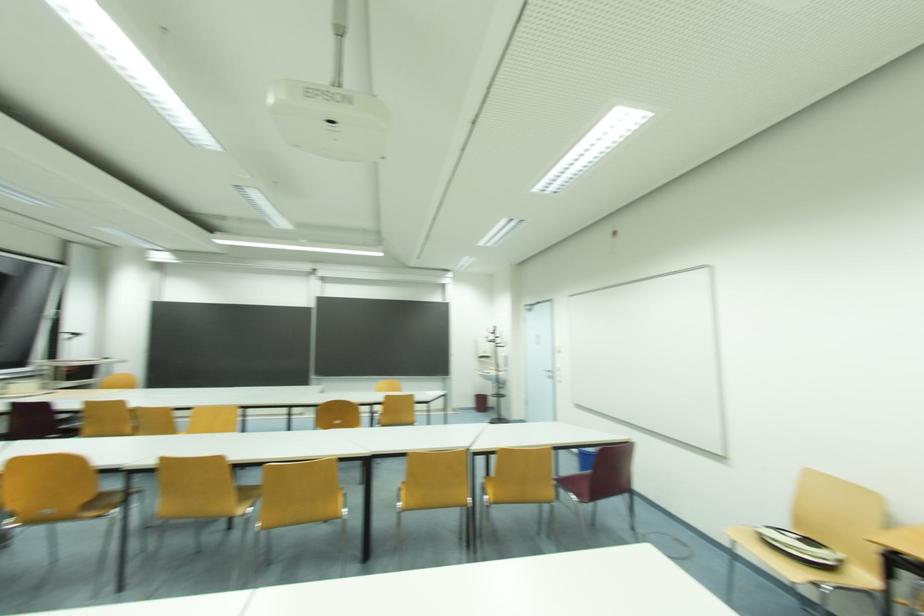
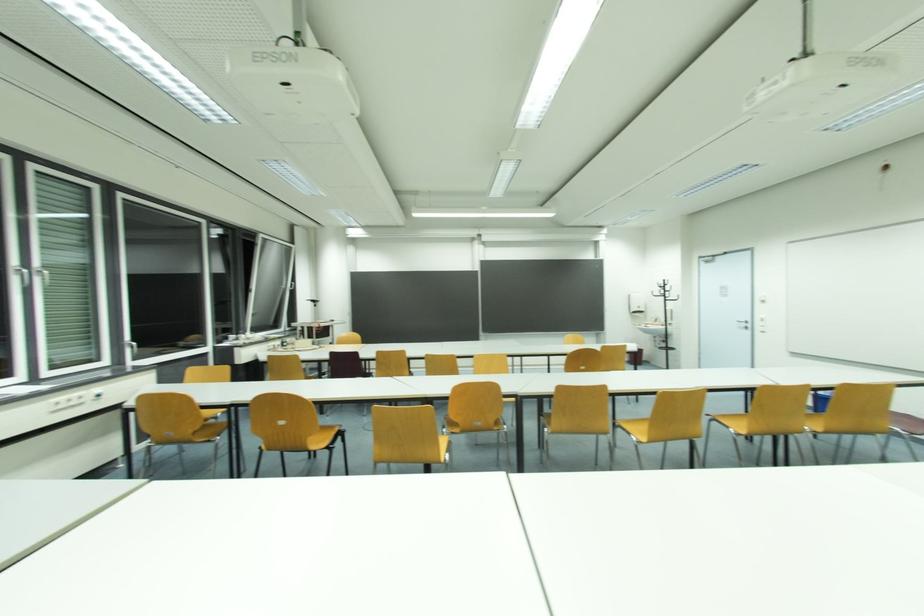
Question: Which direction would the cameraman need to move to produce the second image? Reply with the corresponding letter.

Choices:
 (A) Left
 (B) Right
 (C) Forward
 (D) Backward

Answer: (A)